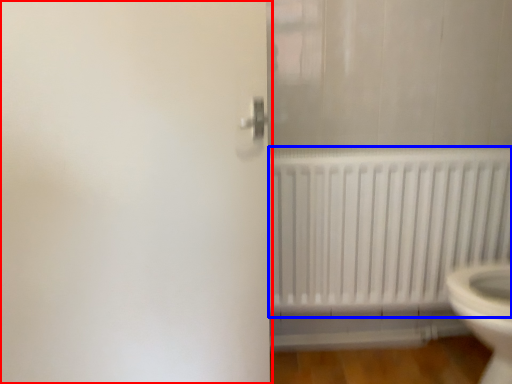
Question: Which object is further to the camera taking this photo, screen door (highlighted by a red box) or radiator (highlighted by a blue box)?

Choices:
 (A) screen door
 (B) radiator

Answer: (B)